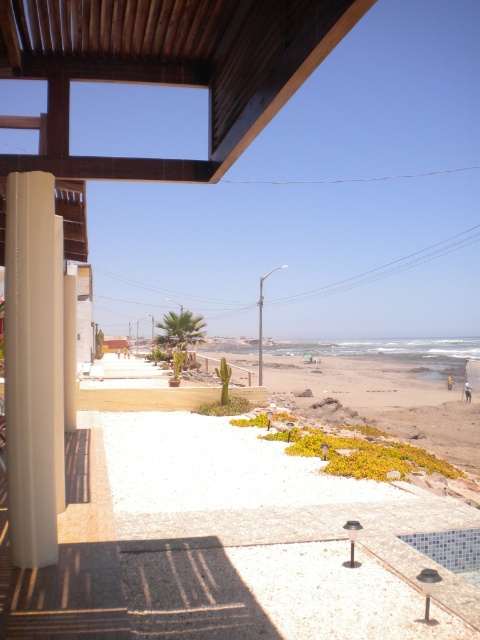
Question: Which object appears farthest from the camera in this image?

Choices:
 (A) green succulent at center
 (B) beige textured balcony at left
 (C) white glossy pillar at left

Answer: (A)

Question: Considering the relative positions of white glossy pillar at left and green succulent at center in the image provided, where is white glossy pillar at left located with respect to green succulent at center?

Choices:
 (A) above
 (B) below

Answer: (A)

Question: Among these objects, which one is nearest to the camera?

Choices:
 (A) green succulent at center
 (B) beige textured balcony at left

Answer: (B)

Question: Where is white glossy pillar at left located in relation to green succulent at center in the image?

Choices:
 (A) right
 (B) left

Answer: (B)

Question: Does white glossy pillar at left have a greater width compared to beige textured balcony at left?

Choices:
 (A) no
 (B) yes

Answer: (A)

Question: Based on their relative distances, which object is farther from the beige textured balcony at left?

Choices:
 (A) green succulent at center
 (B) white glossy pillar at left

Answer: (A)